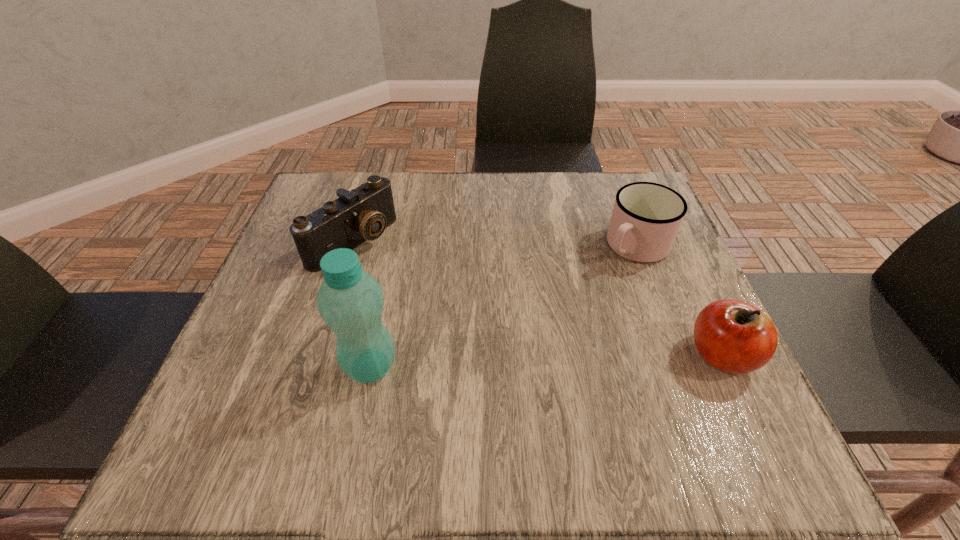
At what (x,y) coordinates should I click in order to perform the action: click on the tallest object. Please return your answer as a coordinate pair (x, y). The width and height of the screenshot is (960, 540). Looking at the image, I should click on [350, 301].

The image size is (960, 540). Find the location of `apple`. apple is located at coordinates (x=733, y=336).

This screenshot has height=540, width=960. What are the coordinates of `camera` in the screenshot? It's located at (362, 214).

Find the location of `mug`. mug is located at coordinates (646, 217).

The image size is (960, 540). Identify the location of vacant space located on the left of the bottle. (235, 366).

Identify the location of blank space located 0.210m on the left of the apple. This screenshot has width=960, height=540. (572, 355).

This screenshot has width=960, height=540. I want to click on vacant space located on the front-facing side of the camera, so click(x=399, y=278).

Where is `vacant space located on the front-facing side of the camera`? This screenshot has width=960, height=540. vacant space located on the front-facing side of the camera is located at coordinates (406, 282).

Find the location of `vacant space located 0.140m on the front-facing side of the camera`. vacant space located 0.140m on the front-facing side of the camera is located at coordinates pos(423,294).

Locate an element on the screen. This screenshot has width=960, height=540. free region located 0.200m on the side of the mug with the handle is located at coordinates (561, 313).